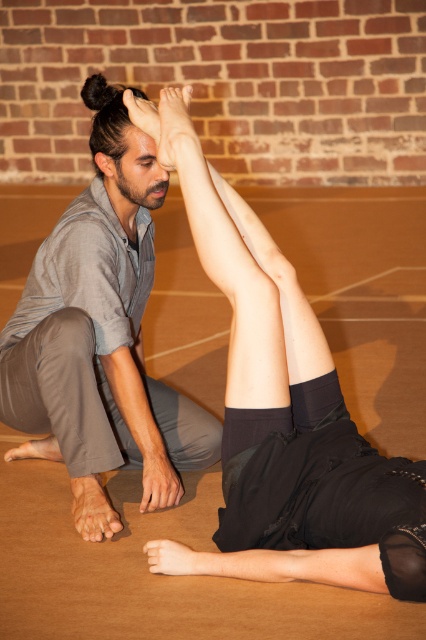
Question: Does smooth skin leg at center come in front of gray cotton shirt at left?

Choices:
 (A) yes
 (B) no

Answer: (A)

Question: Does smooth skin leg at center have a smaller size compared to gray cotton shirt at left?

Choices:
 (A) no
 (B) yes

Answer: (A)

Question: Does smooth skin leg at center appear over gray cotton shirt at left?

Choices:
 (A) yes
 (B) no

Answer: (B)

Question: Which of the following is the closest to the observer?

Choices:
 (A) [356, 429]
 (B) [138, 438]

Answer: (A)